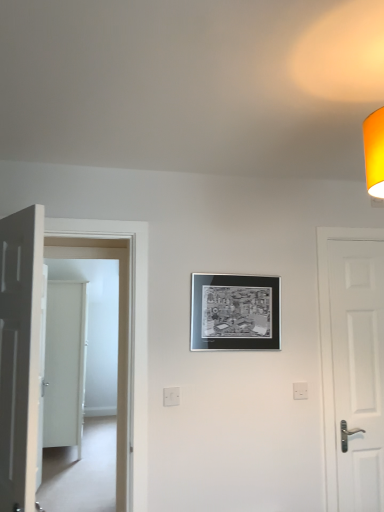
I want to click on white plastic electric outlet at lower center, the first electric outlet when ordered from right to left, so click(x=300, y=391).

Locate an element on the screen. white matte door at left, the fourth door when ordered from right to left is located at coordinates (65, 364).

Find the location of a particular element. The image size is (384, 512). white matte door at left, which is the first door from front to back is located at coordinates (20, 354).

This screenshot has width=384, height=512. Describe the element at coordinates (171, 396) in the screenshot. I see `white plastic electric outlet at center, positioned as the second electric outlet in back-to-front order` at that location.

Where is `white matte door at right, acting as the first door starting from the right`? The width and height of the screenshot is (384, 512). white matte door at right, acting as the first door starting from the right is located at coordinates (358, 370).

What do you see at coordinates (120, 330) in the screenshot? I see `white glossy door at left, the 2th door in the front-to-back sequence` at bounding box center [120, 330].

Locate an element on the screen. This screenshot has width=384, height=512. white plastic electric outlet at lower center, which is counted as the first electric outlet, starting from the back is located at coordinates [300, 391].

From a real-world perspective, which is physically below, white glossy door at left, the 2th door in the front-to-back sequence, or white matte door at left, which is the fourth door from front to back?

In real-world perspective, white matte door at left, which is the fourth door from front to back, is lower.

Which object is wider, white glossy door at left, which is the 3th door in back-to-front order, or white matte door at left, the fourth door when ordered from right to left?

Wider between the two is white matte door at left, the fourth door when ordered from right to left.

Is white glossy door at left, positioned as the third door in left-to-right order, facing towards white matte door at left, the fourth door when ordered from right to left?

No, white glossy door at left, positioned as the third door in left-to-right order, is not aimed at white matte door at left, the fourth door when ordered from right to left.

In terms of height, does white glossy door at left, the 2th door in the front-to-back sequence, look taller or shorter compared to white matte door at left, arranged as the 1th door when viewed from the back?

white glossy door at left, the 2th door in the front-to-back sequence, is shorter than white matte door at left, arranged as the 1th door when viewed from the back.

Is white matte door at left, the 4th door positioned from the back, directly adjacent to white plastic electric outlet at center, which is the 1th electric outlet from left to right?

There is a gap between white matte door at left, the 4th door positioned from the back, and white plastic electric outlet at center, which is the 1th electric outlet from left to right.

Is white matte door at left, which is counted as the third door, starting from the right, smaller than white plastic electric outlet at center, the 2th electric outlet in the right-to-left sequence?

A: Incorrect, white matte door at left, which is counted as the third door, starting from the right, is not smaller in size than white plastic electric outlet at center, the 2th electric outlet in the right-to-left sequence.

From the picture: Is white plastic electric outlet at center, the 2th electric outlet in the right-to-left sequence, a part of white matte door at left, the 4th door positioned from the back?

No, white plastic electric outlet at center, the 2th electric outlet in the right-to-left sequence, is not a part of white matte door at left, the 4th door positioned from the back.

Could you tell me if white plastic electric outlet at center, marked as the 1th electric outlet in a front-to-back arrangement, is turned towards white matte door at right, which is the 3th door in front-to-back order?

No, white plastic electric outlet at center, marked as the 1th electric outlet in a front-to-back arrangement, does not turn towards white matte door at right, which is the 3th door in front-to-back order.

Is white plastic electric outlet at center, marked as the 1th electric outlet in a front-to-back arrangement, bigger than white matte door at right, arranged as the 4th door when viewed from the left?

No, white plastic electric outlet at center, marked as the 1th electric outlet in a front-to-back arrangement, is not bigger than white matte door at right, arranged as the 4th door when viewed from the left.

Which of these two, white plastic electric outlet at center, positioned as the second electric outlet in back-to-front order, or white matte door at right, arranged as the 4th door when viewed from the left, is thinner?

With smaller width is white plastic electric outlet at center, positioned as the second electric outlet in back-to-front order.

Does point (2, 370) appear closer or farther from the camera than point (134, 407)?

Point (2, 370).

Between white matte door at left, placed as the second door when sorted from left to right, and white glossy door at left, which is the 3th door in back-to-front order, which one has smaller width?

white matte door at left, placed as the second door when sorted from left to right, is thinner.

From the image's perspective, is white matte door at left, which is the first door from front to back, located beneath white glossy door at left, which is the 3th door in back-to-front order?

No, from the image's perspective, white matte door at left, which is the first door from front to back, is not below white glossy door at left, which is the 3th door in back-to-front order.

From a real-world perspective, is white matte door at left, placed as the second door when sorted from left to right, above or below white glossy door at left, the 2th door in the front-to-back sequence?

white matte door at left, placed as the second door when sorted from left to right, is situated higher than white glossy door at left, the 2th door in the front-to-back sequence, in the real world.

Is white plastic electric outlet at center, positioned as the second electric outlet in back-to-front order, not inside white matte door at left, placed as the second door when sorted from left to right?

Absolutely, white plastic electric outlet at center, positioned as the second electric outlet in back-to-front order, is external to white matte door at left, placed as the second door when sorted from left to right.

From a real-world perspective, starting from the white matte door at left, placed as the second door when sorted from left to right, which electric outlet is the 1st one below it? Please provide its 2D coordinates.

[(171, 396)]

Considering the sizes of objects white plastic electric outlet at center, positioned as the second electric outlet in back-to-front order, and white matte door at left, which is counted as the third door, starting from the right, in the image provided, who is wider, white plastic electric outlet at center, positioned as the second electric outlet in back-to-front order, or white matte door at left, which is counted as the third door, starting from the right,?

Wider between the two is white matte door at left, which is counted as the third door, starting from the right.

How different are the orientations of white plastic electric outlet at center, positioned as the second electric outlet in back-to-front order, and white matte door at left, which is the first door from front to back, in degrees?

They differ by 114 degrees in their facing directions.

Between metallic silver picture frame at center and white plastic electric outlet at lower center, the 2th electric outlet when ordered from left to right, which one has more height?

metallic silver picture frame at center is taller.

Could white plastic electric outlet at lower center, which is counted as the first electric outlet, starting from the back, be considered to be inside metallic silver picture frame at center?

That's incorrect, white plastic electric outlet at lower center, which is counted as the first electric outlet, starting from the back, is not inside metallic silver picture frame at center.

Is metallic silver picture frame at center next to white plastic electric outlet at lower center, the first electric outlet when ordered from right to left, and touching it?

No, metallic silver picture frame at center is not in contact with white plastic electric outlet at lower center, the first electric outlet when ordered from right to left.

Is metallic silver picture frame at center completely or partially inside white matte door at right, arranged as the 4th door when viewed from the left?

No, metallic silver picture frame at center is not inside white matte door at right, arranged as the 4th door when viewed from the left.

Is point (350, 497) in front of point (274, 284)?

Yes, point (350, 497) is closer to viewer.

Is white matte door at right, acting as the first door starting from the right, positioned in front of metallic silver picture frame at center?

No, it is behind metallic silver picture frame at center.

The width and height of the screenshot is (384, 512). What are the coordinates of `the 2nd door behind when counting from the white glossy door at left, the 2th door in the front-to-back sequence` in the screenshot? It's located at (65, 364).

Locate an element on the screen. Image resolution: width=384 pixels, height=512 pixels. door that is the 3rd object above the white plastic electric outlet at center, marked as the 1th electric outlet in a front-to-back arrangement (from a real-world perspective) is located at coordinates (20, 354).

Based on their spatial positions, is white matte door at left, the fourth door when ordered from right to left, or white matte door at left, which is counted as the third door, starting from the right, further from white matte door at right, arranged as the 4th door when viewed from the left?

Among the two, white matte door at left, the fourth door when ordered from right to left, is located further to white matte door at right, arranged as the 4th door when viewed from the left.

Considering their positions, is white matte door at left, which is counted as the third door, starting from the right, positioned closer to white matte door at left, arranged as the 1th door when viewed from the back, than white matte door at right, the second door in the back-to-front sequence?

white matte door at left, which is counted as the third door, starting from the right, is positioned closer to the anchor white matte door at left, arranged as the 1th door when viewed from the back.

Estimate the real-world distances between objects in this image. Which object is further from white matte door at left, arranged as the 1th door when viewed from the back, metallic silver picture frame at center or white plastic electric outlet at lower center, the 2th electric outlet viewed from the front?

Among the two, white plastic electric outlet at lower center, the 2th electric outlet viewed from the front, is located further to white matte door at left, arranged as the 1th door when viewed from the back.

Estimate the real-world distances between objects in this image. Which object is closer to white plastic electric outlet at lower center, the 2th electric outlet when ordered from left to right, metallic silver picture frame at center or white matte door at left, which appears as the 1th door when viewed from the left?

metallic silver picture frame at center lies closer to white plastic electric outlet at lower center, the 2th electric outlet when ordered from left to right, than the other object.

From the picture: When comparing their distances from white matte door at left, the fourth door when ordered from right to left, does white glossy door at left, which is the 3th door in back-to-front order, or white matte door at right, arranged as the 4th door when viewed from the left, seem closer?

The object closer to white matte door at left, the fourth door when ordered from right to left, is white glossy door at left, which is the 3th door in back-to-front order.

Estimate the real-world distances between objects in this image. Which object is closer to white glossy door at left, which is the 3th door in back-to-front order, white matte door at right, arranged as the 4th door when viewed from the left, or white matte door at left, which is the first door from front to back?

Based on the image, white matte door at left, which is the first door from front to back, appears to be nearer to white glossy door at left, which is the 3th door in back-to-front order.

When comparing their distances from white glossy door at left, positioned as the third door in left-to-right order, does metallic silver picture frame at center or white matte door at left, which is the fourth door from front to back, seem further?

Among the two, white matte door at left, which is the fourth door from front to back, is located further to white glossy door at left, positioned as the third door in left-to-right order.

Based on their spatial positions, is white matte door at left, which is counted as the third door, starting from the right, or white plastic electric outlet at lower center, the 2th electric outlet when ordered from left to right, further from white matte door at right, the second door in the back-to-front sequence?

white matte door at left, which is counted as the third door, starting from the right, lies further to white matte door at right, the second door in the back-to-front sequence, than the other object.

Locate an element on the screen. This screenshot has height=512, width=384. electric outlet between white glossy door at left, the 2th door when ordered from right to left, and white plastic electric outlet at lower center, the first electric outlet when ordered from right to left is located at coordinates (171, 396).

You are a GUI agent. You are given a task and a screenshot of the screen. Output one action in this format:
    pyautogui.click(x=<x>, y=<y>)
    Task: Click on the electric outlet between white matte door at left, which is the first door from front to back, and metallic silver picture frame at center
    This screenshot has width=384, height=512.
    Given the screenshot: What is the action you would take?
    pyautogui.click(x=171, y=396)

Find the location of a particular element. electric outlet located between metallic silver picture frame at center and white matte door at left, arranged as the 1th door when viewed from the back, in the depth direction is located at coordinates (300, 391).

Where is `picture frame situated between white glossy door at left, positioned as the third door in left-to-right order, and white matte door at right, arranged as the 4th door when viewed from the left, from left to right`? picture frame situated between white glossy door at left, positioned as the third door in left-to-right order, and white matte door at right, arranged as the 4th door when viewed from the left, from left to right is located at coordinates (235, 312).